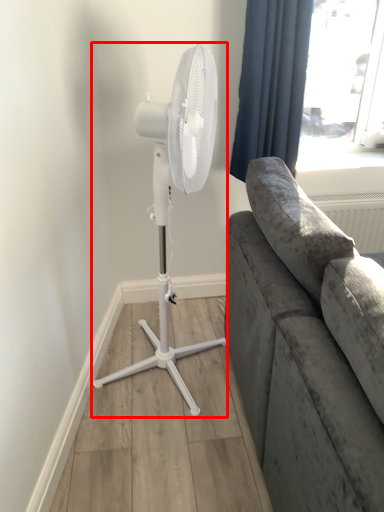
Question: From the image's perspective, where is mechanical fan (annotated by the red box) located relative to curtain?

Choices:
 (A) above
 (B) below

Answer: (B)